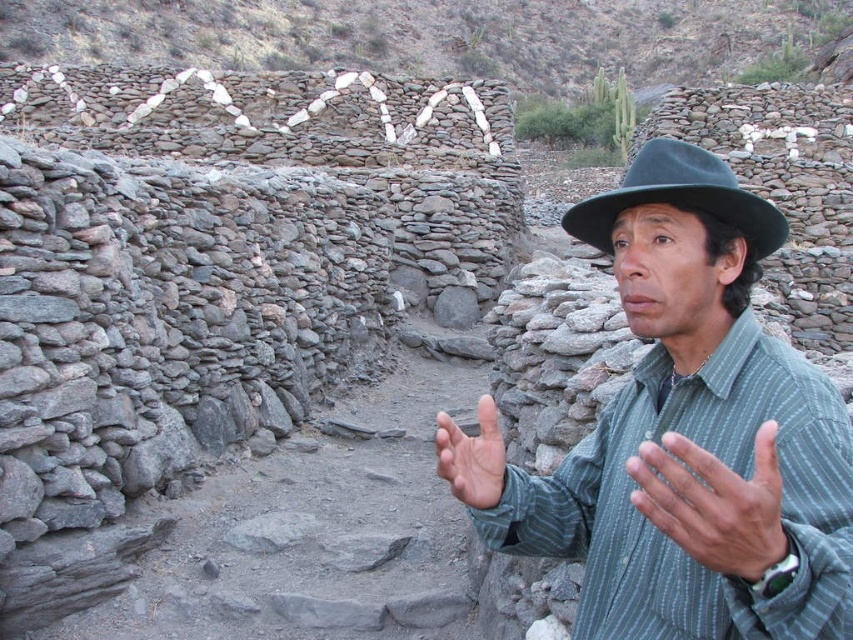
Is point (633, 496) behind point (447, 480)?

No, (633, 496) is in front of (447, 480).

Is gray striped shirt at lower right to the left of smooth skin hand at center from the viewer's perspective?

No, gray striped shirt at lower right is not to the left of smooth skin hand at center.

Measure the distance between gray striped shirt at lower right and camera.

→ gray striped shirt at lower right and camera are 51.98 feet apart from each other.

You are a GUI agent. You are given a task and a screenshot of the screen. Output one action in this format:
    pyautogui.click(x=<x>, y=<y>)
    Task: Click on the gray striped shirt at lower right
    The width and height of the screenshot is (853, 640).
    Given the screenshot: What is the action you would take?
    pyautogui.click(x=712, y=502)

Can you confirm if black felt fedora at center is positioned above smooth skin hand at center?

Correct, black felt fedora at center is located above smooth skin hand at center.

Does point (675, 189) come farther from viewer compared to point (480, 493)?

No, it is in front of (480, 493).

Who is more distant from viewer, (701, 202) or (445, 472)?

The point (445, 472) is behind.

Where is `black felt fedora at center`? black felt fedora at center is located at coordinates (679, 196).

Is the position of green striped shirt at center less distant than that of black felt fedora at center?

Yes, it is in front of black felt fedora at center.

Can you confirm if green striped shirt at center is smaller than black felt fedora at center?

No, green striped shirt at center is not smaller than black felt fedora at center.

The width and height of the screenshot is (853, 640). What are the coordinates of `green striped shirt at center` in the screenshot? It's located at coord(695,435).